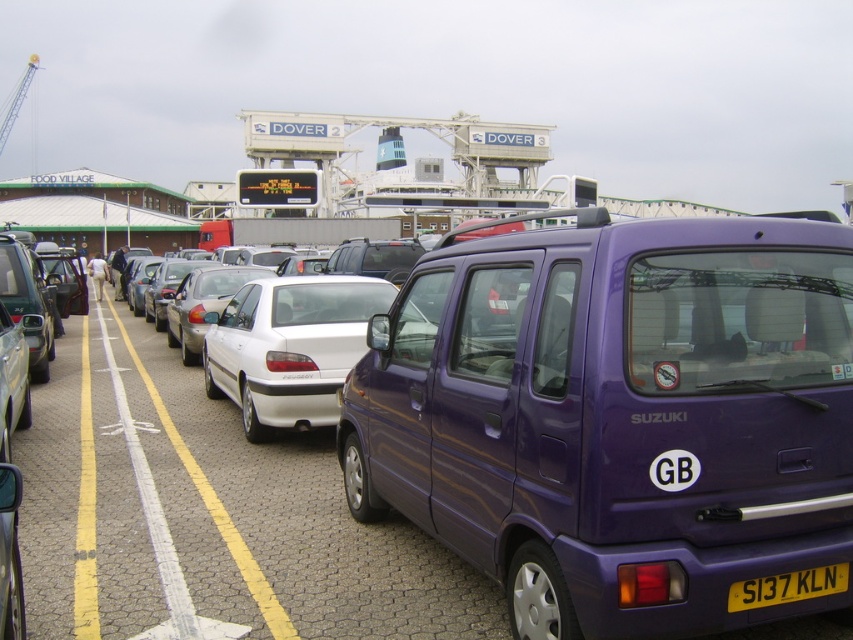
Does yellow painted line at center have a smaller size compared to white glossy car at center?

Incorrect, yellow painted line at center is not smaller in size than white glossy car at center.

Is point (91, 518) farther from camera compared to point (155, 388)?

No, it is not.

Where is `yellow painted line at center`? The height and width of the screenshot is (640, 853). yellow painted line at center is located at coordinates (85, 509).

Is point (91, 468) positioned before point (772, 584)?

No, it is behind (772, 584).

Does yellow painted line at center have a smaller size compared to yellow plastic license plate at lower right?

Incorrect, yellow painted line at center is not smaller in size than yellow plastic license plate at lower right.

In order to click on yellow painted line at center in this screenshot , I will do `click(85, 509)`.

In the scene shown: Does purple matte van at center appear on the right side of yellow painted line at center?

Indeed, purple matte van at center is positioned on the right side of yellow painted line at center.

Which is in front, point (790, 268) or point (83, 349)?

Point (790, 268) is more forward.

This screenshot has height=640, width=853. What do you see at coordinates (618, 417) in the screenshot?
I see `purple matte van at center` at bounding box center [618, 417].

Where is `purple matte van at center`? This screenshot has height=640, width=853. purple matte van at center is located at coordinates (618, 417).